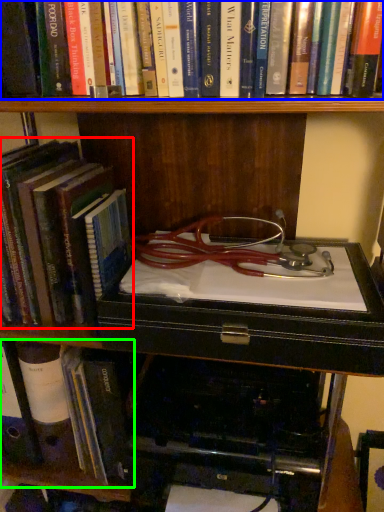
Question: Estimate the real-world distances between objects in this image. Which object is closer to book (highlighted by a red box), book (highlighted by a blue box) or book (highlighted by a green box)?

Choices:
 (A) book
 (B) book

Answer: (B)